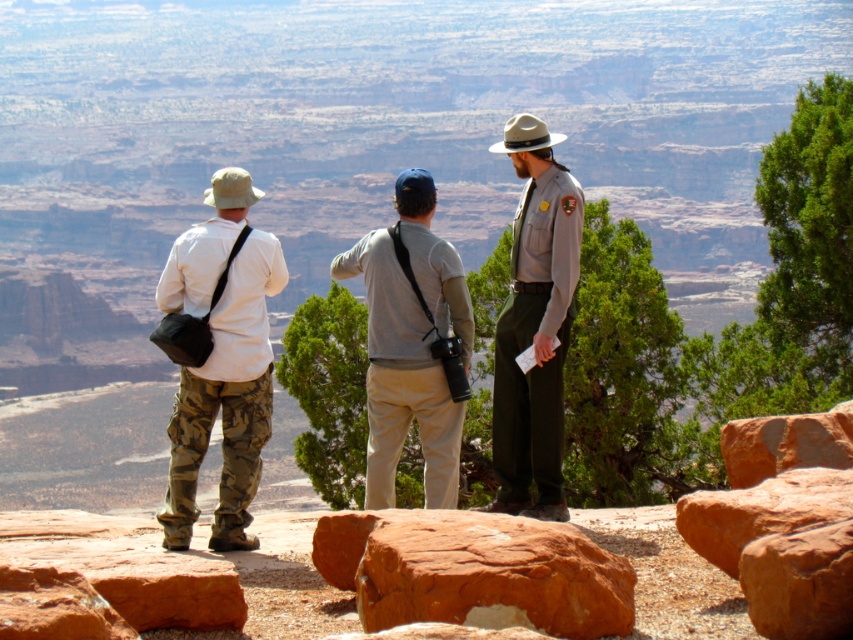
Does point (498, 589) come behind point (431, 269)?

No.

The image size is (853, 640). Find the location of `rusty rock at center`. rusty rock at center is located at coordinates (492, 576).

Does rusty rock at center have a greater height compared to gray uniform at center?

No, rusty rock at center is not taller than gray uniform at center.

Find the location of a particular element. The image size is (853, 640). rusty rock at center is located at coordinates (492, 576).

Does point (577, 636) come closer to viewer compared to point (558, 385)?

Yes, point (577, 636) is in front of point (558, 385).

Find the location of `rusty rock at center`. rusty rock at center is located at coordinates pos(492,576).

Which of these two, camo pants at center or gray uniform at center, stands taller?

gray uniform at center

Between point (247, 477) and point (550, 474), which one is positioned in front?

Point (247, 477) is in front.

Which is behind, point (178, 468) or point (517, 339)?

The point (517, 339) is more distant.

Locate an element on the screen. camo pants at center is located at coordinates point(221,358).